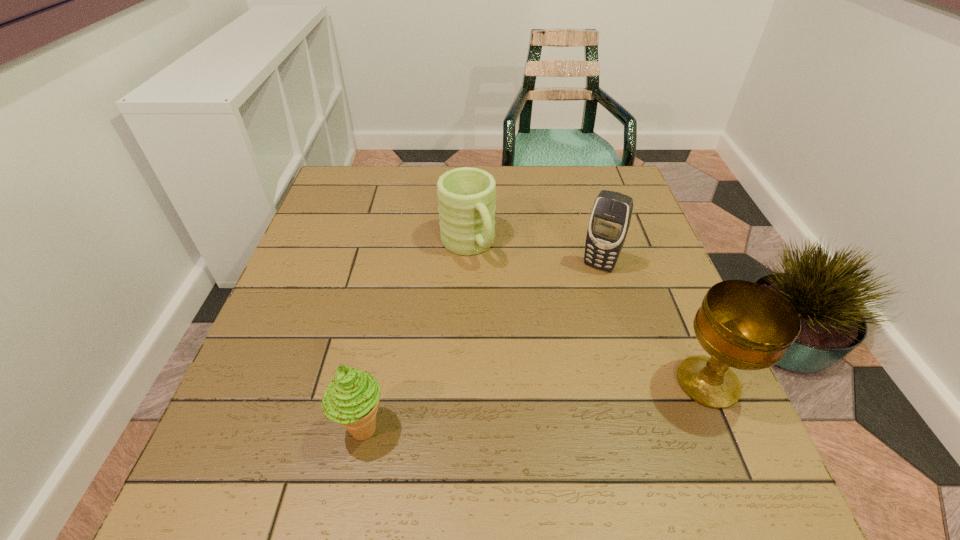
You are a GUI agent. You are given a task and a screenshot of the screen. Output one action in this format:
    pyautogui.click(x=<x>, y=<y>)
    Task: Click on the free region at the far left corner of the desktop
    The width and height of the screenshot is (960, 540).
    Given the screenshot: What is the action you would take?
    pyautogui.click(x=340, y=168)

The height and width of the screenshot is (540, 960). Find the location of `free region at the far right corner of the desktop`. free region at the far right corner of the desktop is located at coordinates (628, 193).

Image resolution: width=960 pixels, height=540 pixels. In the image, there is a desktop. Identify the location of vacant space at the near right corner. (718, 415).

You are a GUI agent. You are given a task and a screenshot of the screen. Output one action in this format:
    pyautogui.click(x=<x>, y=<y>)
    Task: Click on the vacant space that's between the third object from right to left and the chalice
    
    Given the screenshot: What is the action you would take?
    pyautogui.click(x=588, y=314)

Identify the location of free space between the icecream and the chalice. (536, 406).

Where is `vacant space that's between the icecream and the third object from right to left`? This screenshot has height=540, width=960. vacant space that's between the icecream and the third object from right to left is located at coordinates (416, 337).

Find the location of a particular element. This screenshot has width=960, height=540. free space between the mug and the cellular telephone is located at coordinates (533, 255).

Where is `vacant space that's between the icecream and the rightmost object`? This screenshot has width=960, height=540. vacant space that's between the icecream and the rightmost object is located at coordinates (536, 406).

The image size is (960, 540). In order to click on free space between the second object from right to left and the second object from left to right in this screenshot , I will do `click(533, 255)`.

Where is `free space between the chalice and the cellular telephone`? Image resolution: width=960 pixels, height=540 pixels. free space between the chalice and the cellular telephone is located at coordinates (654, 324).